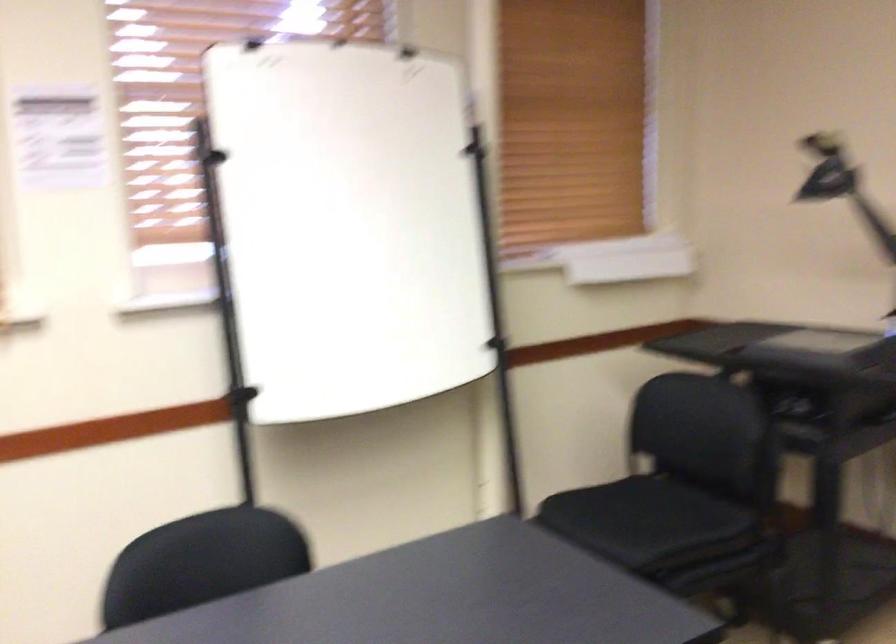
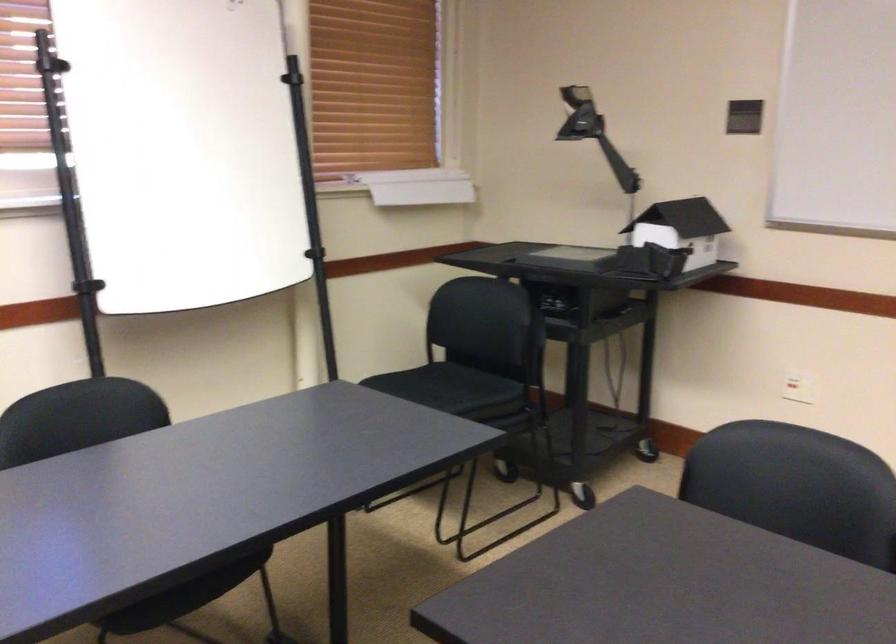
The point at (651, 504) is marked in the first image. Where is the corresponding point in the second image?

(449, 383)